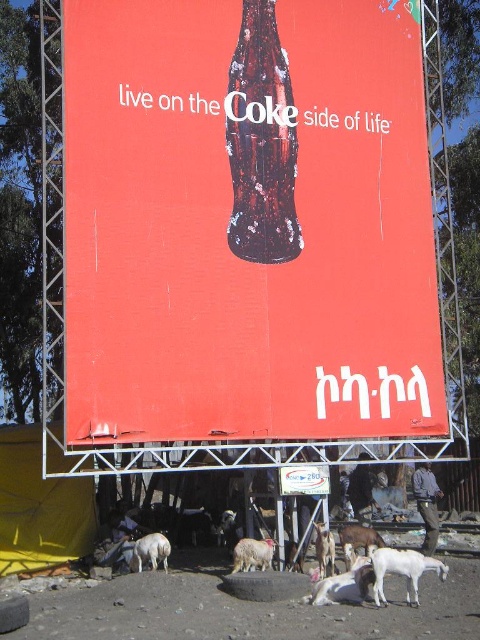
You are a farmer who needs to separate your animals. You have a white woolen sheep at lower center and a white woolen goat at center. If you want to place a fence between them, what is the minimum length of the fence required?

The white woolen sheep at lower center is 3.84 meters away from the white woolen goat at center. To place a fence between them, the minimum length required is 3.84 meters.

You are a photographer standing in front of the large red billboard. You notice a white woolen sheep at lower center and a white woolen goat at center. Which animal is closer to the left edge of the billboard?

The white woolen sheep at lower center is positioned on the left side of white woolen goat at center, so it is closer to the left edge of the billboard.